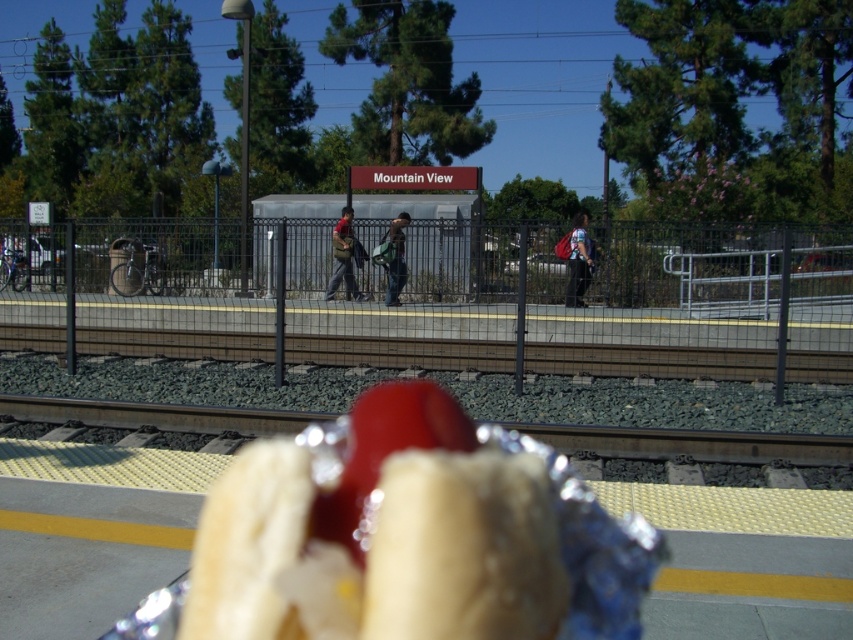
Looking at this image, you are a traveler at Mountain View station and you have two backpacks, the matte brown backpack at center and the green fabric backpack at center. You want to place both on the yellow tactile paving strip so they won

The matte brown backpack at center has a lesser height compared to green fabric backpack at center. Since the yellow tactile paving strip is a designated safety area, it is advisable to place the taller green fabric backpack at center first to ensure both can fit without obstructing the view of the tracks.

You are at Mountain View train station and want to buy a hot dog. The vendor is located at the point with coordinates (383, 532). Where is the shiny foil hot dog located?

The point (383, 532) corresponds to the shiny foil hot dog at center, so the shiny foil hot dog is located at the center of the image.

You are a traveler at Mountain View station and you want to put your denim jacket at center and matte brown backpack at center into a storage locker. The locker has a maximum capacity of 0.5 cubic meters. Can you estimate if both items will fit together?

The denim jacket at center is larger in size than matte brown backpack at center. However, without specific dimensions for each item, it is impossible to determine if their combined volume exceeds the locker capacity. Please check the exact sizes of both items.